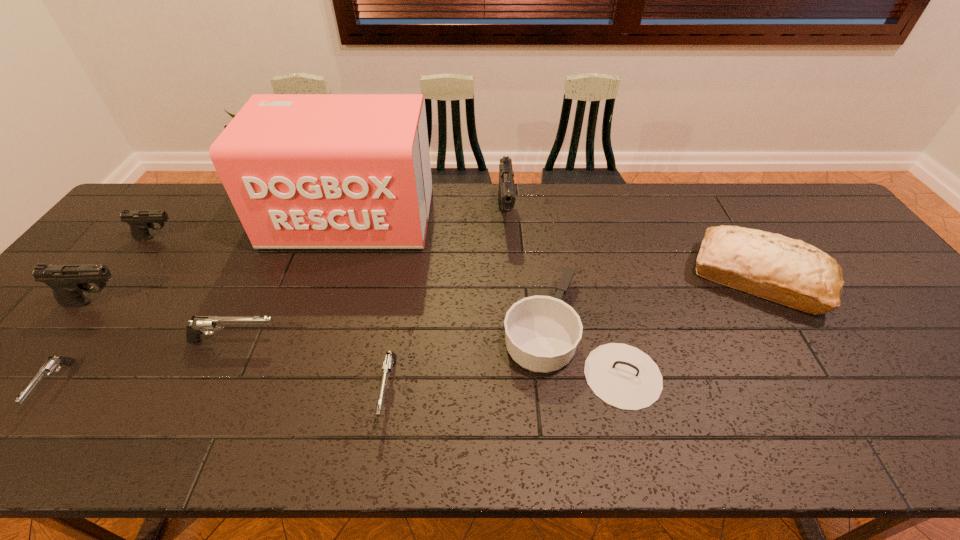
Identify the location of vacant position in the image that satisfies the following two spatial constraints: 1. on the front-facing side of the farthest silver pistol; 2. on the front-facing side of the shortest object. The height and width of the screenshot is (540, 960). (214, 385).

This screenshot has width=960, height=540. I want to click on vacant point that satisfies the following two spatial constraints: 1. at the barrel of the rightmost black pistol; 2. on the right side of the saucepan, so click(514, 336).

Find the location of a particular element. This screenshot has width=960, height=540. free region that satisfies the following two spatial constraints: 1. at the barrel of the tallest pistol; 2. at the barrel of the second smallest black pistol is located at coordinates (511, 302).

I want to click on vacant area that satisfies the following two spatial constraints: 1. on the front-facing side of the biggest silver pistol; 2. on the front-facing side of the shortest pistol, so click(x=214, y=385).

At what (x,y) coordinates should I click in order to perform the action: click on free location that satisfies the following two spatial constraints: 1. on the surface of the pink box where the text is embossed; 2. at the barrel of the nearest black pistol. Please return your answer as a coordinate pair (x, y). Looking at the image, I should click on (324, 302).

At what (x,y) coordinates should I click in order to perform the action: click on free spot that satisfies the following two spatial constraints: 1. on the surface of the box where the text is embossed; 2. at the barrel of the second tallest pistol. Please return your answer as a coordinate pair (x, y). Looking at the image, I should click on (324, 302).